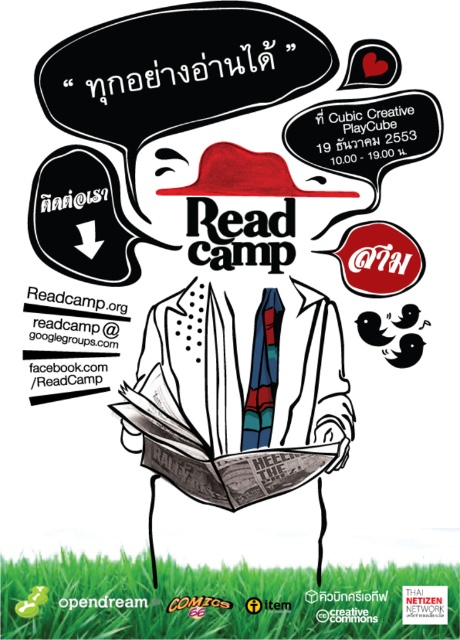
Between point (229, 502) and point (394, 353), which one is positioned in front?

Point (229, 502)

Is the position of white dotted shirt at center more distant than that of black matte birds at center?

No, white dotted shirt at center is closer to the viewer.

Is point (225, 496) closer to viewer compared to point (409, 360)?

That is True.

Identify the location of white dotted shirt at center. Image resolution: width=460 pixels, height=640 pixels. tap(236, 401).

Does point (249, 460) come in front of point (276, 308)?

Yes, it is.

Between white dotted shirt at center and stained glass tie at center, which one appears on the right side from the viewer's perspective?

From the viewer's perspective, stained glass tie at center appears more on the right side.

Is point (193, 205) behind point (270, 353)?

No, it is not.

The image size is (460, 640). Identify the location of white dotted shirt at center. (236, 401).

Does point (262, 294) lie in front of point (410, 339)?

No, (262, 294) is behind (410, 339).

Does stained glass tie at center have a lesser height compared to black matte birds at center?

In fact, stained glass tie at center may be taller than black matte birds at center.

Is point (254, 419) more distant than point (364, 323)?

No, it is in front of (364, 323).

Locate an element on the screen. The image size is (460, 640). stained glass tie at center is located at coordinates (263, 372).